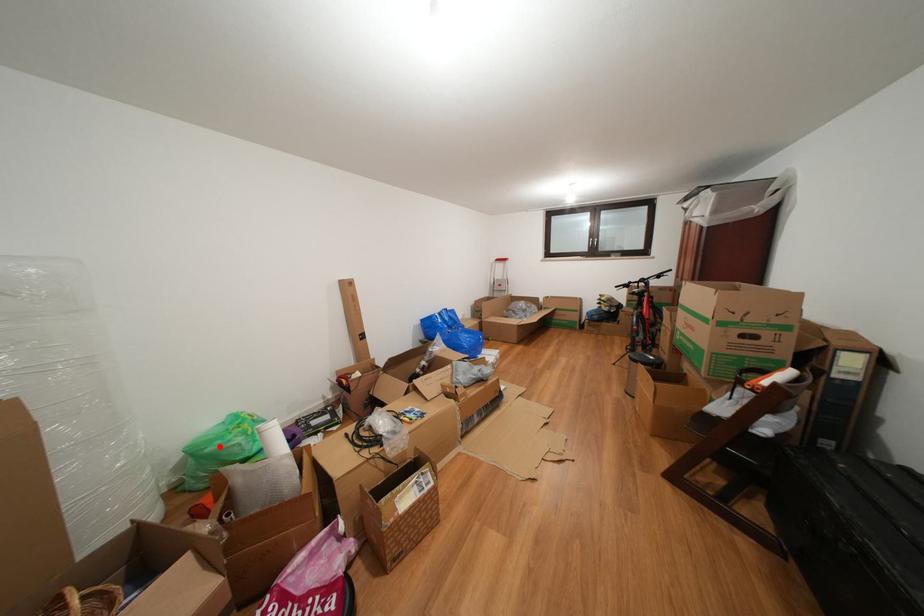
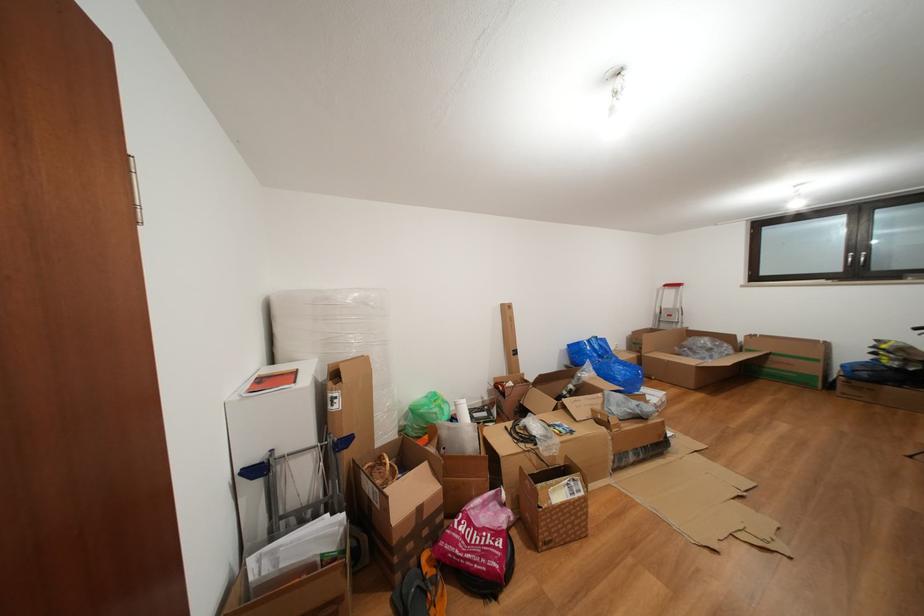
The point at the highlighted location is marked in the first image. Where is the corresponding point in the second image?

(431, 411)